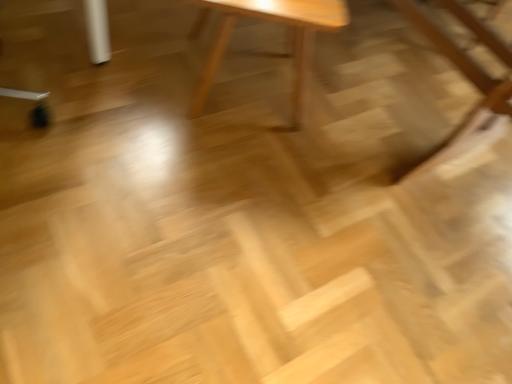
What do you see at coordinates (268, 53) in the screenshot? I see `light wood table at center` at bounding box center [268, 53].

What is the approximate height of light wood table at center?

The height of light wood table at center is 19.86 inches.

Identify the location of light wood table at center. (268, 53).

Find the location of `light wood table at center`. light wood table at center is located at coordinates (268, 53).